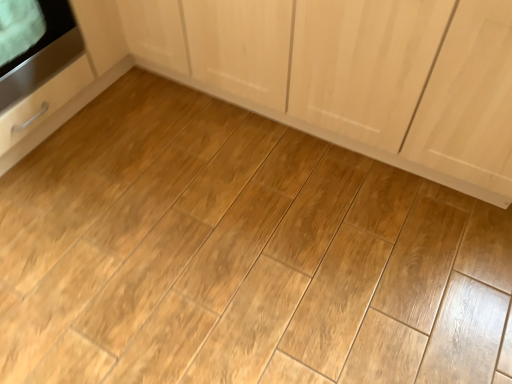
The height and width of the screenshot is (384, 512). What do you see at coordinates (304, 68) in the screenshot?
I see `light wood cabinetry at center` at bounding box center [304, 68].

Find the location of a particular element. light wood cabinetry at center is located at coordinates (304, 68).

In order to face light wood cabinetry at center, should I rotate leftwards or rightwards?

Rotate right and turn 11.343 degrees.

The height and width of the screenshot is (384, 512). Find the location of `light wood cabinetry at center`. light wood cabinetry at center is located at coordinates (304, 68).